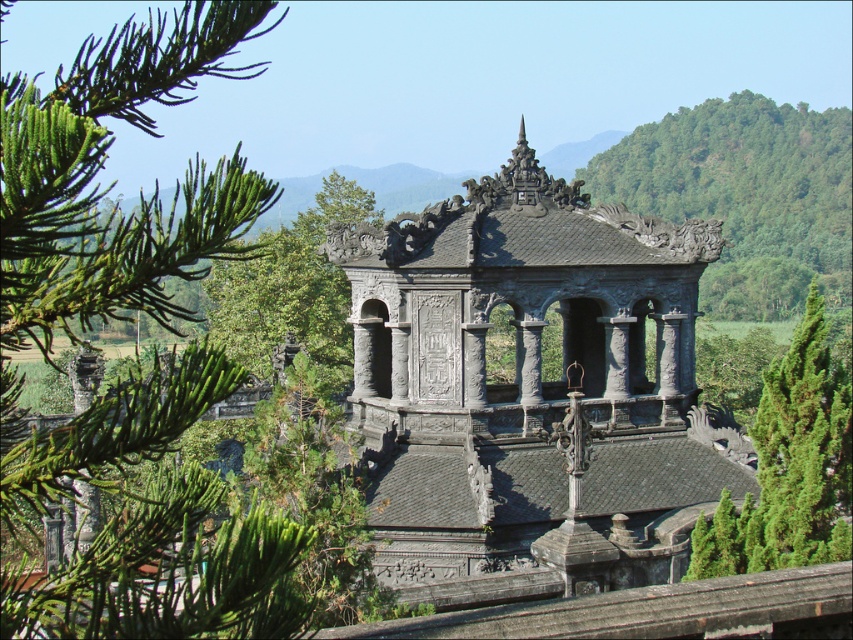
Can you confirm if green leafy tree at upper right is smaller than green textured tree at right?

No, green leafy tree at upper right is not smaller than green textured tree at right.

The height and width of the screenshot is (640, 853). In order to click on green leafy tree at upper right in this screenshot , I will do `click(746, 195)`.

Image resolution: width=853 pixels, height=640 pixels. What are the coordinates of `green leafy tree at upper right` in the screenshot? It's located at (746, 195).

Consider the image. Can you confirm if dark gray stone gazebo at center is positioned to the right of green leafy tree at upper right?

No, dark gray stone gazebo at center is not to the right of green leafy tree at upper right.

Can you confirm if dark gray stone gazebo at center is positioned to the left of green leafy tree at upper right?

Indeed, dark gray stone gazebo at center is positioned on the left side of green leafy tree at upper right.

Identify the location of dark gray stone gazebo at center. (529, 388).

Find the location of a particular element. The height and width of the screenshot is (640, 853). dark gray stone gazebo at center is located at coordinates (529, 388).

Does dark gray stone gazebo at center have a lesser height compared to green textured tree at right?

In fact, dark gray stone gazebo at center may be taller than green textured tree at right.

Can you confirm if dark gray stone gazebo at center is positioned above green textured tree at right?

Indeed, dark gray stone gazebo at center is positioned over green textured tree at right.

At what (x,y) coordinates should I click in order to perform the action: click on dark gray stone gazebo at center. Please return your answer as a coordinate pair (x, y). The width and height of the screenshot is (853, 640). Looking at the image, I should click on (529, 388).

Find the location of a particular element. dark gray stone gazebo at center is located at coordinates (529, 388).